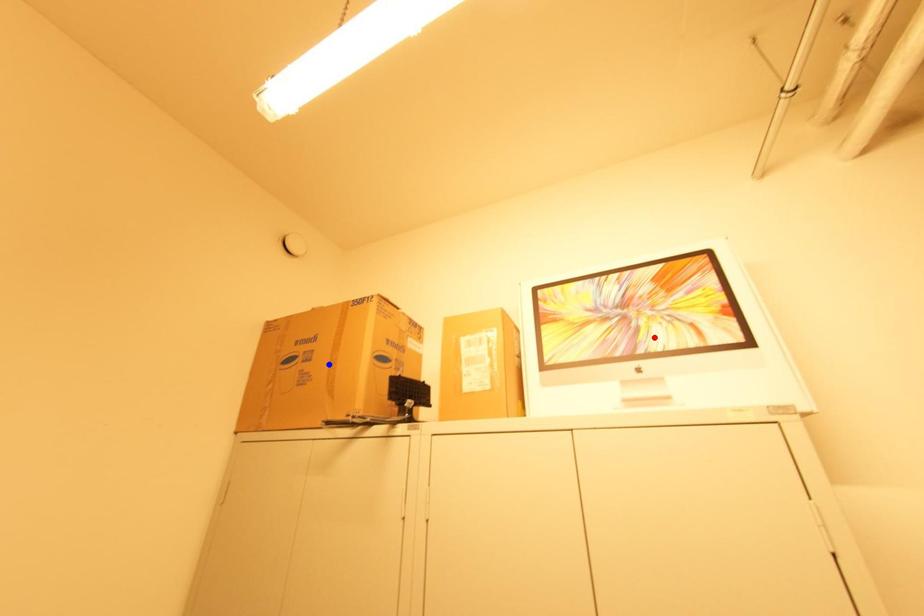
Question: In the image, two points are highlighted. Which point is nearer to the camera? Reply with the corresponding letter.

Choices:
 (A) blue point
 (B) red point

Answer: (B)